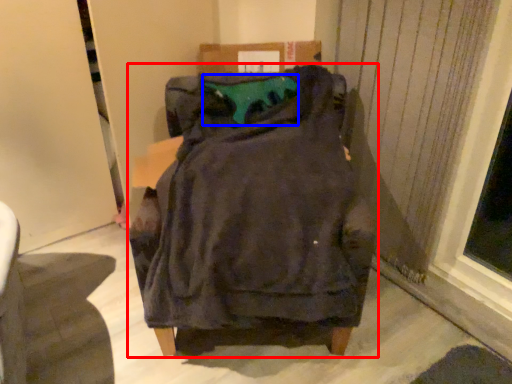
Question: Which point is closer to the camera, furniture (highlighted by a red box) or teal (highlighted by a blue box)?

Choices:
 (A) furniture
 (B) teal

Answer: (A)